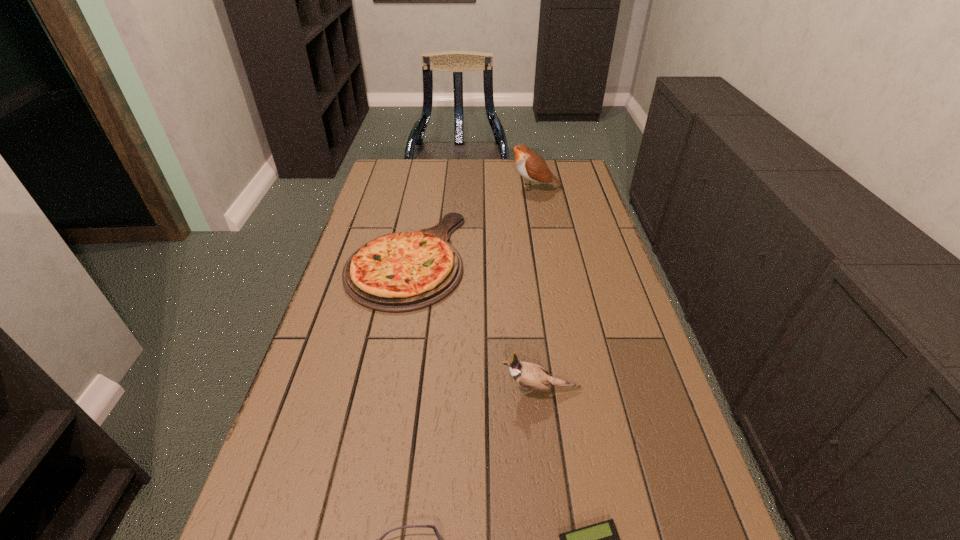
Where is `free point located at the face of the third farthest object`? This screenshot has height=540, width=960. free point located at the face of the third farthest object is located at coordinates (335, 389).

The height and width of the screenshot is (540, 960). What are the coordinates of `free space located 0.170m at the face of the third farthest object` in the screenshot? It's located at (422, 389).

Locate an element on the screen. This screenshot has height=540, width=960. vacant region located 0.070m on the right of the second farthest object is located at coordinates (487, 258).

Where is `object that is at the far edge`? Image resolution: width=960 pixels, height=540 pixels. object that is at the far edge is located at coordinates (531, 166).

Where is `object that is at the left edge`? This screenshot has height=540, width=960. object that is at the left edge is located at coordinates (399, 272).

At what (x,y) coordinates should I click in order to perform the action: click on object positioned at the right edge. Please return your answer as a coordinate pair (x, y). This screenshot has width=960, height=540. Looking at the image, I should click on tap(531, 166).

What are the coordinates of `object that is at the far right corner` in the screenshot? It's located at (531, 166).

Where is `free space at the far edge`? free space at the far edge is located at coordinates (444, 168).

The height and width of the screenshot is (540, 960). In order to click on free spot at the left edge of the desktop in this screenshot , I will do `click(296, 528)`.

At what (x,y) coordinates should I click in order to perform the action: click on free spot at the right edge of the desktop. Please return your answer as a coordinate pair (x, y). The height and width of the screenshot is (540, 960). Looking at the image, I should click on (570, 255).